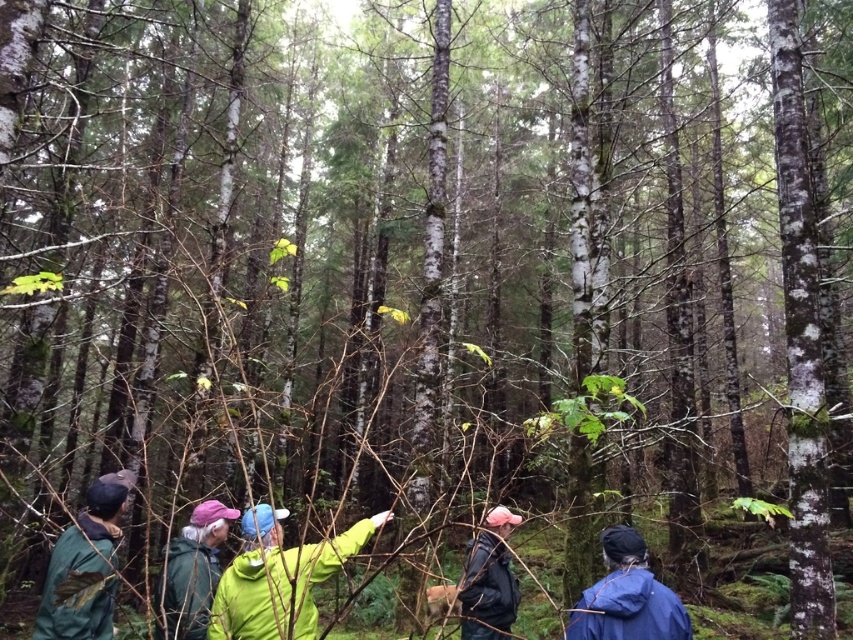
Does green matte jacket at center have a smaller size compared to blue matte jacket at lower right?

Actually, green matte jacket at center might be larger than blue matte jacket at lower right.

Can you confirm if green matte jacket at center is wider than blue matte jacket at lower right?

Indeed, green matte jacket at center has a greater width compared to blue matte jacket at lower right.

Which is in front, point (267, 577) or point (647, 605)?

Positioned in front is point (267, 577).

The height and width of the screenshot is (640, 853). Find the location of `green matte jacket at center`. green matte jacket at center is located at coordinates (277, 577).

Is green matte jacket at center above dark gray jacket at lower right?

Yes.

Is green matte jacket at center taller than dark gray jacket at lower right?

No, green matte jacket at center is not taller than dark gray jacket at lower right.

Identify the location of green matte jacket at center. (277, 577).

Locate an element on the screen. The image size is (853, 640). green matte jacket at center is located at coordinates (277, 577).

At what (x,y) coordinates should I click in order to perform the action: click on green matte jacket at center. Please return your answer as a coordinate pair (x, y). Looking at the image, I should click on (277, 577).

In order to click on green matte jacket at center in this screenshot , I will do `click(277, 577)`.